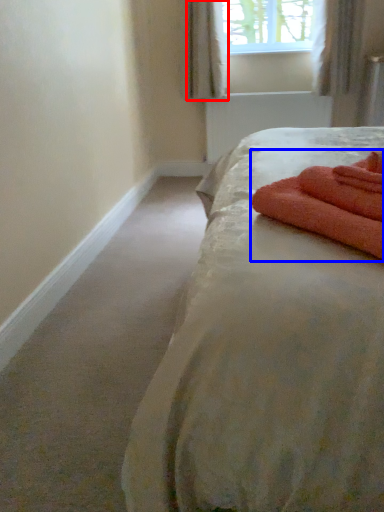
Question: Which point is further to the camera, curtain (highlighted by a red box) or bath towel (highlighted by a blue box)?

Choices:
 (A) curtain
 (B) bath towel

Answer: (A)